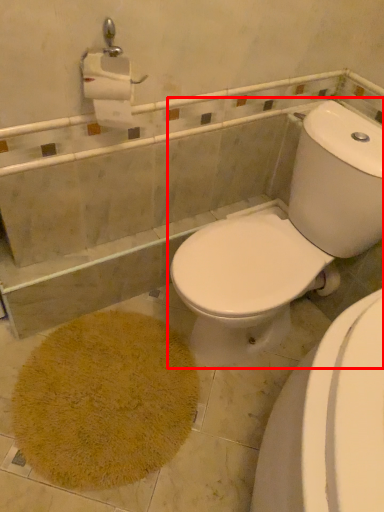
Question: From the image's perspective, what is the correct spatial relationship of toilet (annotated by the red box) in relation to bath mat?

Choices:
 (A) above
 (B) below

Answer: (A)